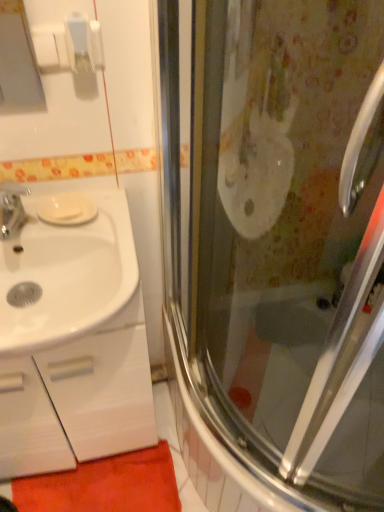
Question: Can we say white glossy cabinet at left lies outside white glossy sink at left?

Choices:
 (A) yes
 (B) no

Answer: (A)

Question: Can you confirm if white glossy cabinet at left is thinner than white glossy sink at left?

Choices:
 (A) yes
 (B) no

Answer: (A)

Question: Can you confirm if white glossy cabinet at left is taller than white glossy sink at left?

Choices:
 (A) no
 (B) yes

Answer: (B)

Question: Can you confirm if white glossy cabinet at left is positioned to the right of white glossy sink at left?

Choices:
 (A) yes
 (B) no

Answer: (B)

Question: Is white glossy cabinet at left far away from white glossy sink at left?

Choices:
 (A) no
 (B) yes

Answer: (A)

Question: Is white glossy cabinet at left smaller than white glossy sink at left?

Choices:
 (A) no
 (B) yes

Answer: (A)

Question: Is there a large distance between white matte soap at left and orange carpet at lower left?

Choices:
 (A) yes
 (B) no

Answer: (B)

Question: Considering the relative sizes of white matte soap at left and orange carpet at lower left in the image provided, is white matte soap at left smaller than orange carpet at lower left?

Choices:
 (A) no
 (B) yes

Answer: (B)

Question: Is white matte soap at left shorter than orange carpet at lower left?

Choices:
 (A) no
 (B) yes

Answer: (B)

Question: Is white matte soap at left outside of orange carpet at lower left?

Choices:
 (A) yes
 (B) no

Answer: (A)

Question: Is white matte soap at left closer to camera compared to orange carpet at lower left?

Choices:
 (A) yes
 (B) no

Answer: (A)

Question: From a real-world perspective, does white matte soap at left stand above orange carpet at lower left?

Choices:
 (A) no
 (B) yes

Answer: (B)

Question: Is white glossy sink at left oriented towards white matte soap at left?

Choices:
 (A) yes
 (B) no

Answer: (B)